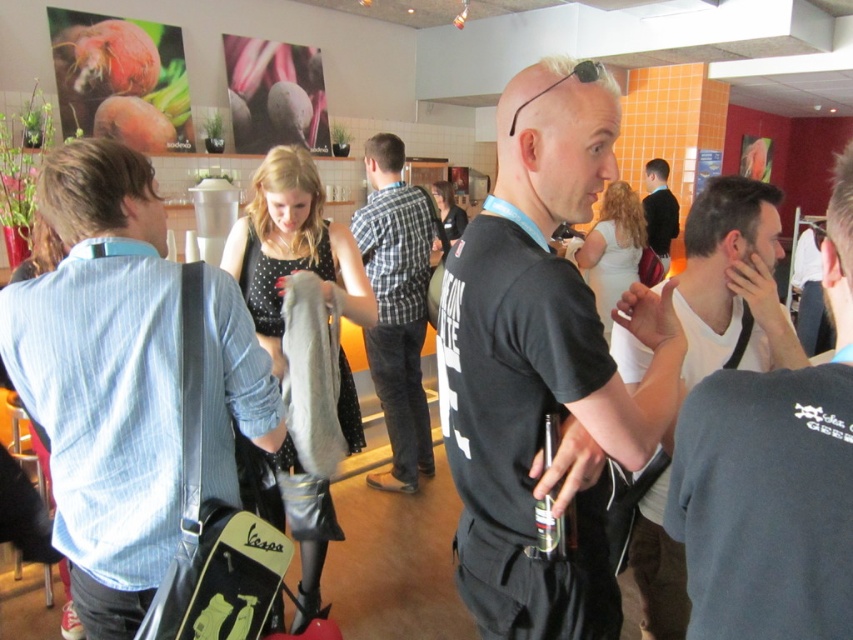
You are standing at the camera position in the scene. There is a white matte tank top at right. Can you reach it without moving your body?

The white matte tank top at right is 1.29 meters from the camera, so you cannot reach it without moving your body since it is too far away.

You are standing in the room and want to know how far the point at coordinates (x=553, y=348) is from you. Can you determine the distance?

The point at coordinates (x=553, y=348) is 1.01 meters from the camera, so you are approximately 1.01 meters away from it.